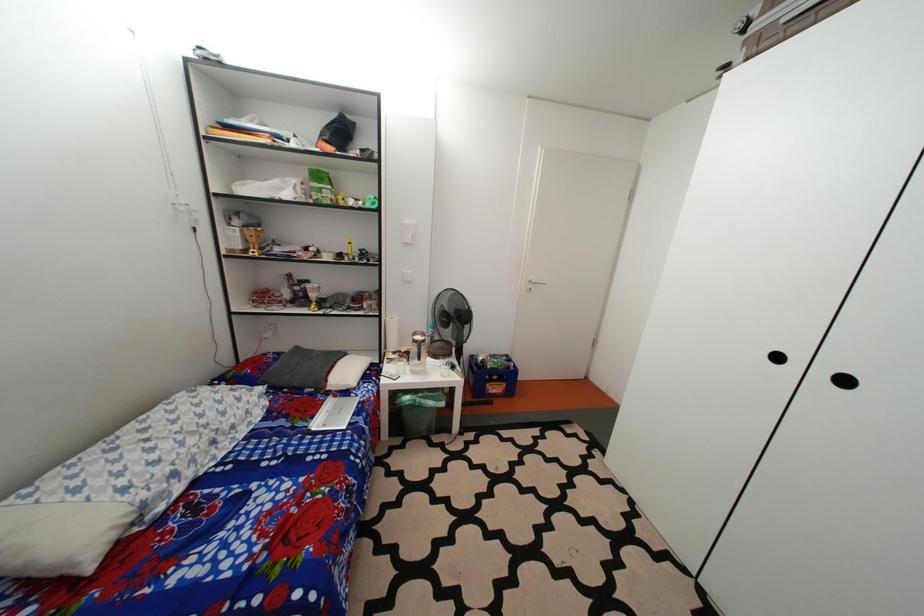
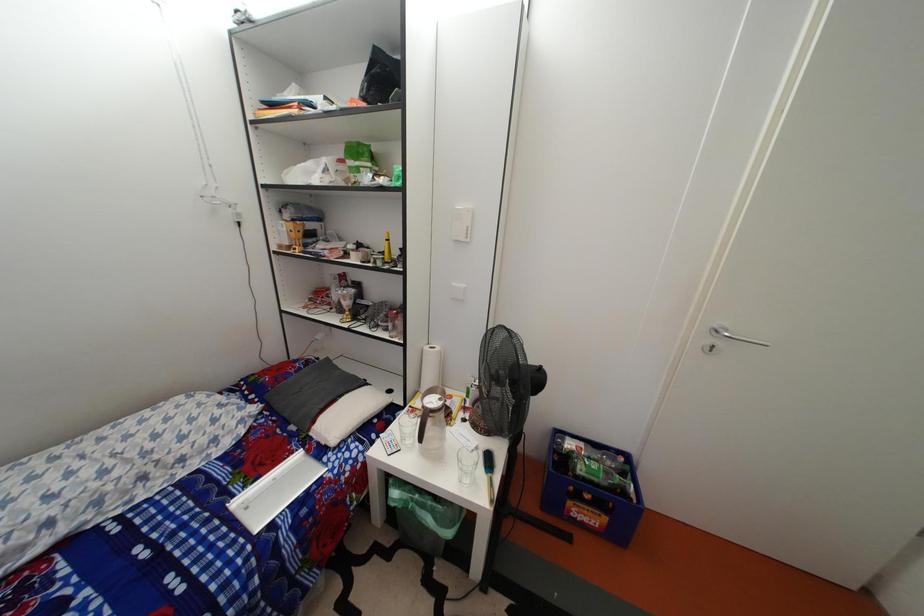
Question: The camera is either moving clockwise (left) or counter-clockwise (right) around the object. The first image is from the beginning of the video and the second image is from the end. Is the camera moving left or right when shooting the video?

Choices:
 (A) Left
 (B) Right

Answer: (B)